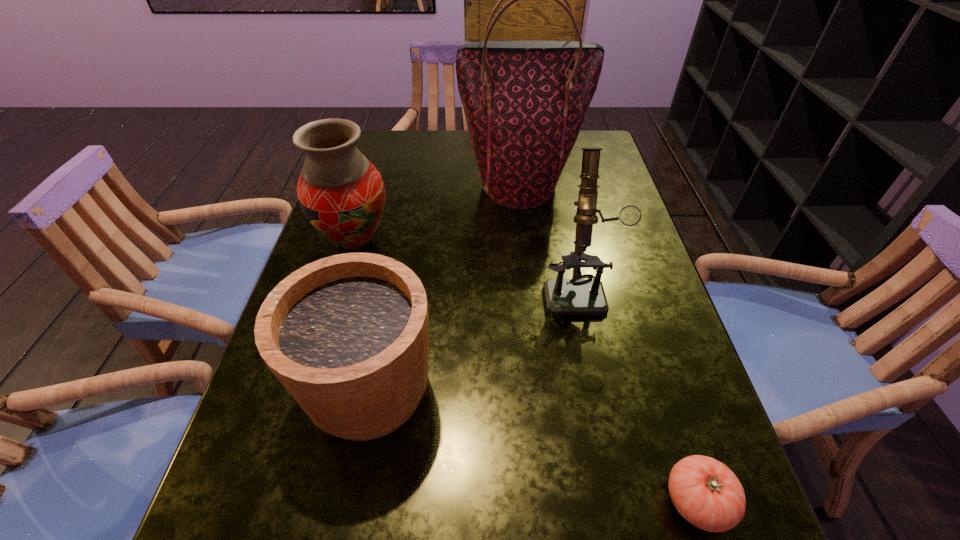
Find the location of `object present at the far right corner`. object present at the far right corner is located at coordinates (524, 101).

Identify the location of object positioned at the near right corner. pos(705,492).

Where is `free space at the far edge`? The image size is (960, 540). free space at the far edge is located at coordinates (467, 164).

In the image, there is a desktop. What are the coordinates of `blank space at the right edge` in the screenshot? It's located at (658, 427).

This screenshot has width=960, height=540. I want to click on vacant region between the farthest object and the vase, so click(x=438, y=213).

I want to click on vacant area that lies between the second shortest object and the shortest object, so click(x=534, y=444).

You are a GUI agent. You are given a task and a screenshot of the screen. Output one action in this format:
    pyautogui.click(x=<x>, y=<y>)
    Task: Click on the unoccupied area between the microscope and the vase
    The width and height of the screenshot is (960, 540).
    Given the screenshot: What is the action you would take?
    pyautogui.click(x=467, y=265)

Where is `unoccupied area between the vase and the tallest object`? Image resolution: width=960 pixels, height=540 pixels. unoccupied area between the vase and the tallest object is located at coordinates (438, 213).

What are the coordinates of `vacant area between the microscope and the handbag` in the screenshot? It's located at (549, 237).

At what (x,y) coordinates should I click in order to perform the action: click on unoccupied area between the microscope and the nearest object. Please return your answer as a coordinate pair (x, y). The image size is (960, 540). Looking at the image, I should click on (637, 394).